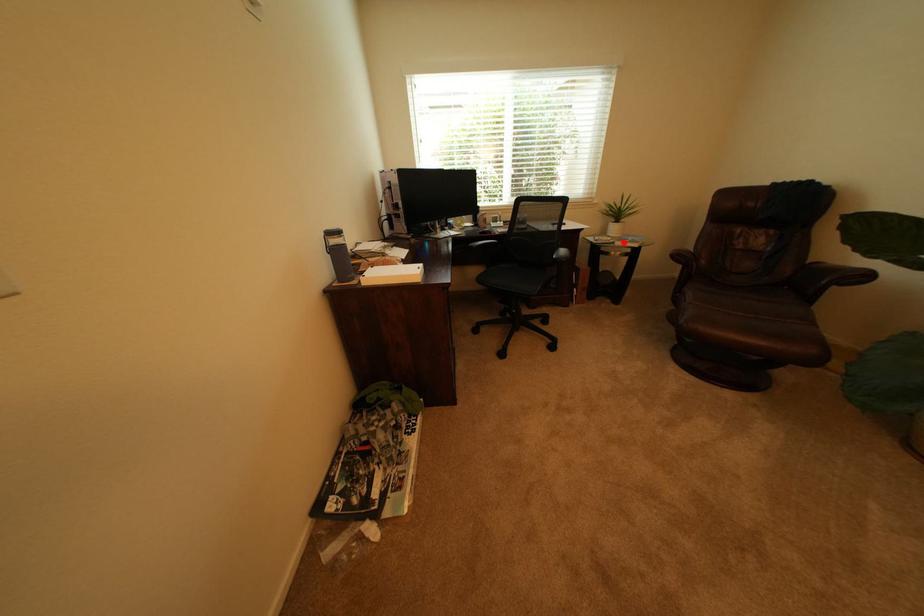
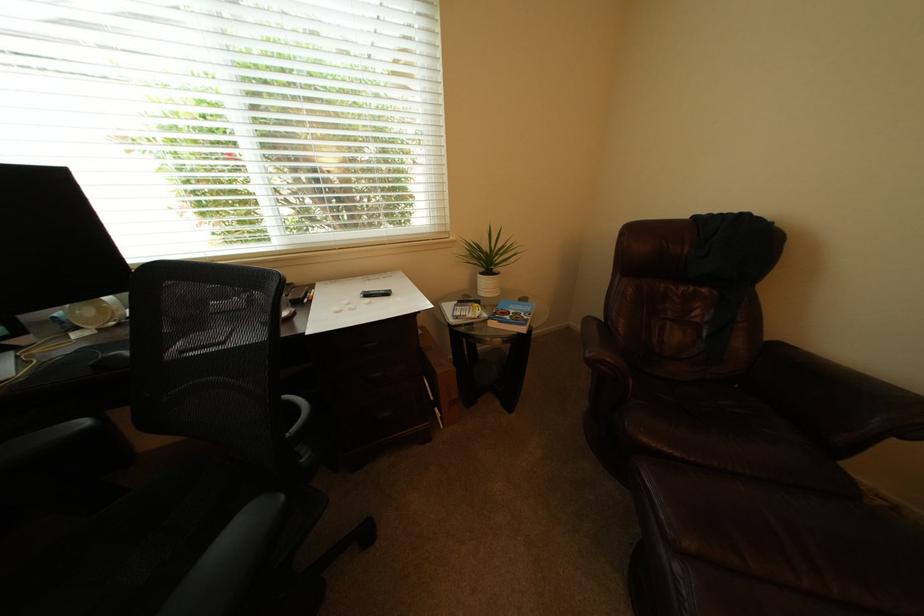
In the second image, find the point that corresponds to the highlighted location in the first image.

(495, 317)